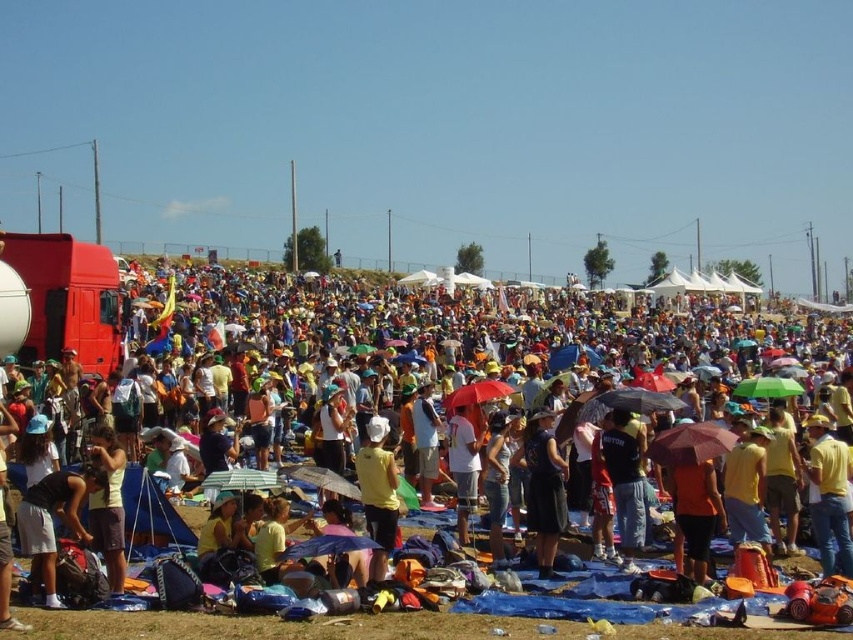
You are a photographer trying to capture a clear shot of the yellow matte shirt at center without any obstructions. Given that the yellow fabric umbrella at center is positioned in front of the shirt, can you determine if the umbrella will block your view of the shirt?

The yellow fabric umbrella at center might be wider than yellow matte shirt at center, so there is a possibility that the umbrella could block the view of the shirt depending on its exact positioning and angle.

You are at the gathering and want to locate both the black dress at center and the yellow matte shirt at center. Which one is positioned to the right side of the other?

The black dress at center is to the right of the yellow matte shirt at center.

You are standing in the crowd and see the yellow fabric umbrella at center and the yellow matte shirt at center. Which one is located to the right of the other?

The yellow fabric umbrella at center is positioned on the right side of yellow matte shirt at center.